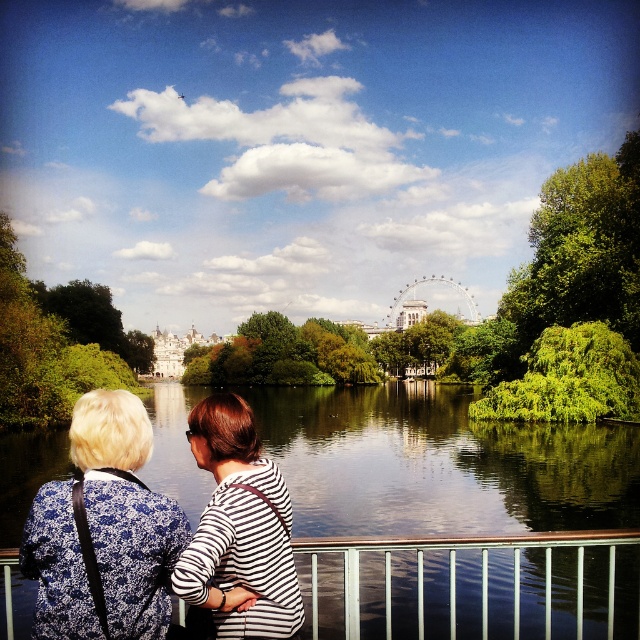
Does white metal balustrade at center have a smaller size compared to striped fabric at center?

Actually, white metal balustrade at center might be larger than striped fabric at center.

The width and height of the screenshot is (640, 640). What do you see at coordinates (472, 586) in the screenshot? I see `white metal balustrade at center` at bounding box center [472, 586].

Which is behind, point (502, 595) or point (291, 628)?

Positioned behind is point (502, 595).

Locate an element on the screen. The height and width of the screenshot is (640, 640). white metal balustrade at center is located at coordinates (472, 586).

Between transparent glass water at center and blue floral blouse at upper left, which one has less height?

With less height is blue floral blouse at upper left.

Does transparent glass water at center appear on the right side of blue floral blouse at upper left?

Correct, you'll find transparent glass water at center to the right of blue floral blouse at upper left.

Find the location of a particular element. transparent glass water at center is located at coordinates (440, 464).

How far apart are white metal balustrade at center and blue floral blouse at upper left?

The distance of white metal balustrade at center from blue floral blouse at upper left is 24.37 meters.

Between white metal balustrade at center and blue floral blouse at upper left, which one is positioned higher?

blue floral blouse at upper left is above.

Does point (385, 608) lie behind point (49, 566)?

Yes, it is behind point (49, 566).

At what (x,y) coordinates should I click in order to perform the action: click on white metal balustrade at center. Please return your answer as a coordinate pair (x, y). This screenshot has height=640, width=640. Looking at the image, I should click on (472, 586).